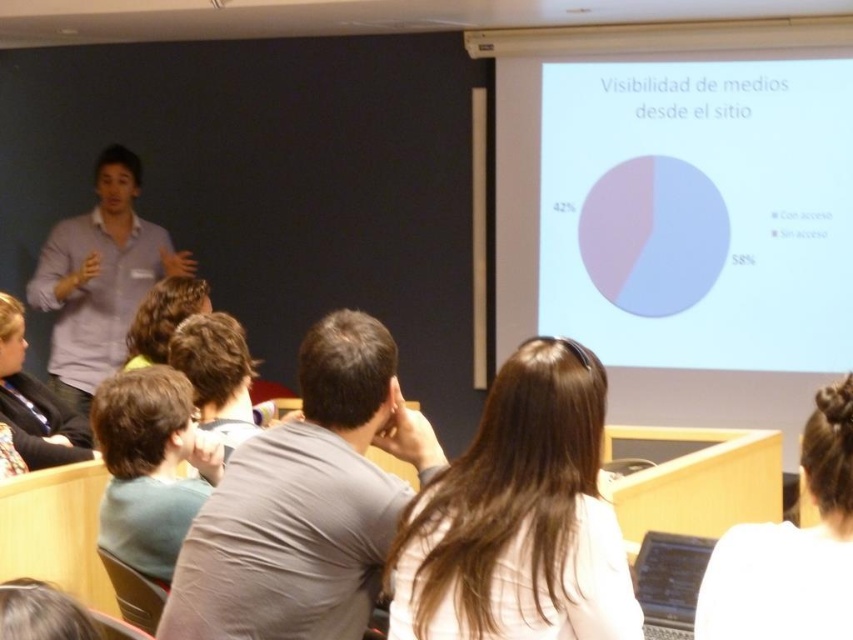
Locate an element on the screen. Image resolution: width=853 pixels, height=640 pixels. gray cotton shirt at center is located at coordinates (306, 502).

Is point (172, 624) positioned in front of point (810, 552)?

No, (172, 624) is further to viewer.

Is point (271, 488) positioned in front of point (718, 573)?

No, (271, 488) is behind (718, 573).

Where is `gray cotton shirt at center`? The width and height of the screenshot is (853, 640). gray cotton shirt at center is located at coordinates (306, 502).

Does white hair at upper right have a smaller size compared to dark brown hair at center?

No, white hair at upper right is not smaller than dark brown hair at center.

Can you confirm if white hair at upper right is shorter than dark brown hair at center?

No.

Who is more forward, (x=802, y=628) or (x=199, y=276)?

Point (x=802, y=628) is more forward.

Locate an element on the screen. The height and width of the screenshot is (640, 853). white hair at upper right is located at coordinates (791, 548).

Can you confirm if gray cotton shirt at center is taller than light blue shirt at left?

In fact, gray cotton shirt at center may be shorter than light blue shirt at left.

Between gray cotton shirt at center and light blue shirt at left, which one is positioned lower?

gray cotton shirt at center

At what (x,y) coordinates should I click in order to perform the action: click on gray cotton shirt at center. Please return your answer as a coordinate pair (x, y). Looking at the image, I should click on (306, 502).